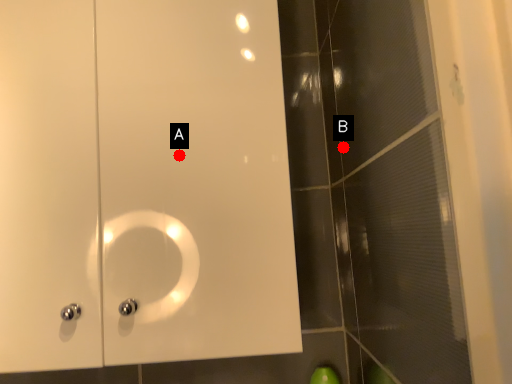
Question: Two points are circled on the image, labeled by A and B beside each circle. Among these points, which one is nearest to the camera?

Choices:
 (A) A is closer
 (B) B is closer

Answer: (A)